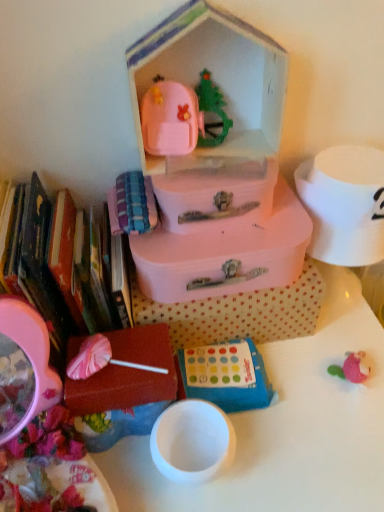
The width and height of the screenshot is (384, 512). Identify the location of free space in front of blue fabric game at center. (262, 471).